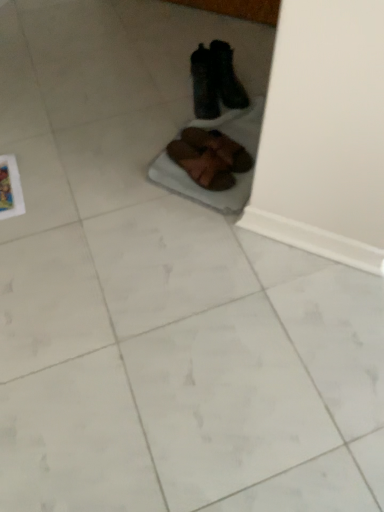
I want to click on free space in front of black fuzzy slippers at center, which ranks as the third footwear in bottom-to-top order, so click(196, 124).